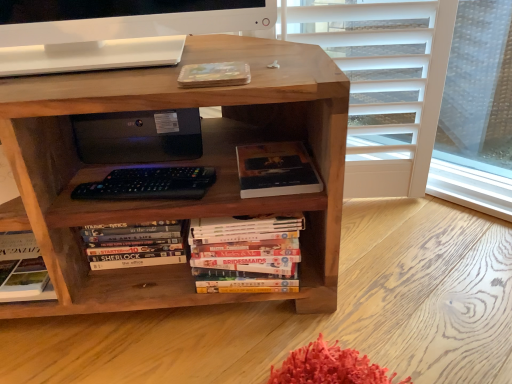
Question: Considering the positions of brown wood bookcase at center and hardcover books at center, the second book in the left-to-right sequence, in the image, is brown wood bookcase at center wider or thinner than hardcover books at center, the second book in the left-to-right sequence,?

Choices:
 (A) wide
 (B) thin

Answer: (A)

Question: From a real-world perspective, is brown wood bookcase at center physically located above or below hardcover books at center, the second book in the left-to-right sequence?

Choices:
 (A) above
 (B) below

Answer: (A)

Question: Which of these objects is positioned closest to the black matte computer at center?

Choices:
 (A) hardcover book at center, the 3th book when ordered from left to right
 (B) hardcover books at center, the second book in the left-to-right sequence
 (C) hardcover book at center, the 1th book positioned from the left
 (D) brown wood bookcase at center

Answer: (C)

Question: Estimate the real-world distances between objects in this image. Which object is farther from the hardcover books at center, the second book in the left-to-right sequence?

Choices:
 (A) hardcover book at center, marked as the first book in a right-to-left arrangement
 (B) black matte computer at center
 (C) brown wood bookcase at center
 (D) hardcover book at center, which ranks as the 3th book in right-to-left order

Answer: (B)